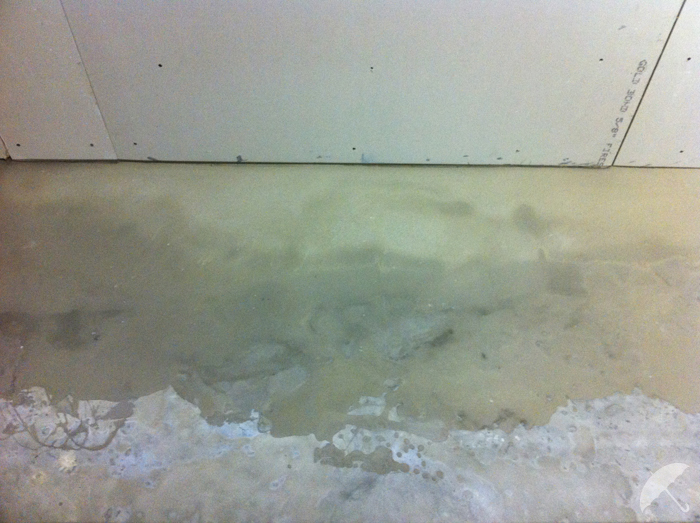
This screenshot has height=523, width=700. I want to click on black dot on wall, so click(x=161, y=65).